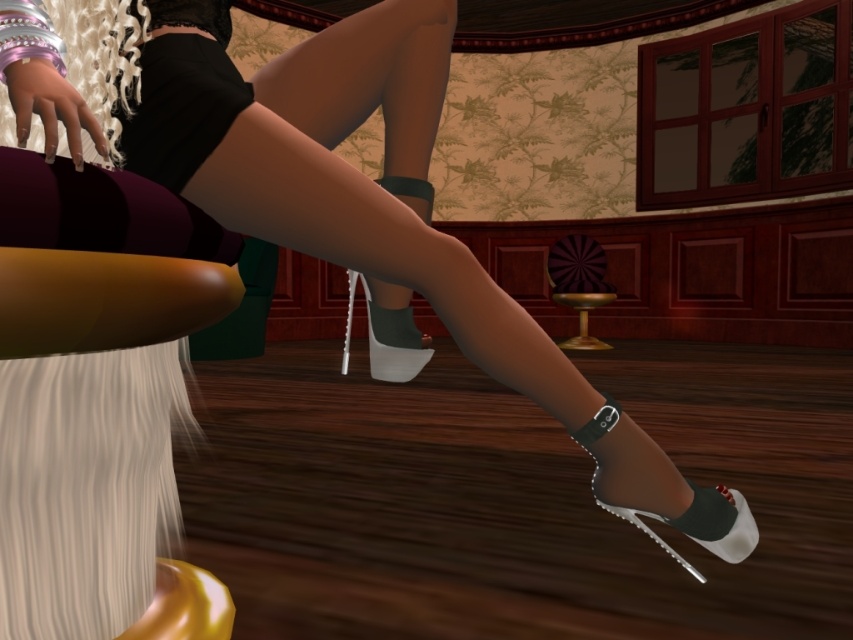
You are a character in the scene and want to touch both the point at coordinates point(695,490) and the point at coordinates point(390,336). Which point should you reach for first to touch the closer one first?

Point(695,490) is closer to the camera than point(390,336), so you should reach for point(695,490) first to touch the closer one first.

You are a photographer trying to capture a closeup shot of the character. You need to adjust your camera to focus on the point at coordinates point (723, 506). Given that the camera is currently 38.03 inches away from this point, is this distance suitable for a clear closeup shot?

The point (723, 506) is 38.03 inches away from the camera. This distance may be too far for a clear closeup shot, as closeups typically require the camera to be much closer to the subject.